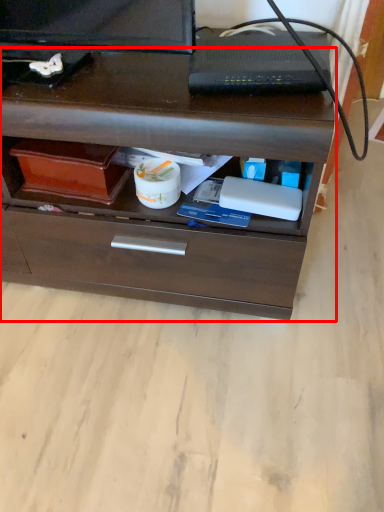
Question: From the image's perspective, where is chest of drawers (annotated by the red box) located relative to appliance?

Choices:
 (A) above
 (B) below

Answer: (B)